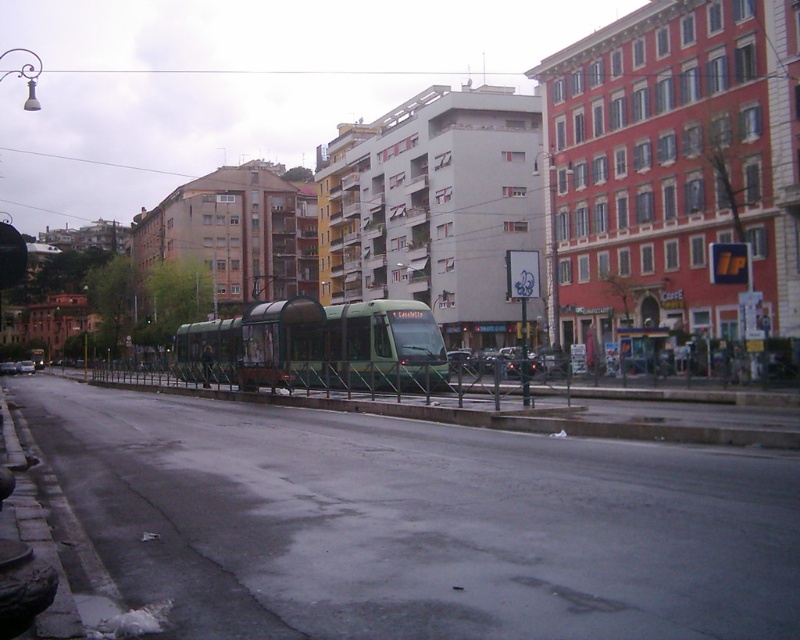
Looking at this image, you are a pedestrian standing at the tram stop. You see the green metallic train at center and the metallic silver car at center. Which one is positioned to the right side?

The green metallic train at center is positioned to the right of the metallic silver car at center.

You are a pedestrian standing at the tram stop on the urban street. You notice a point with coordinates at [318,346]. Based on the scene description, where is this point located?

The point at [318,346] is located on the green metallic train at center.